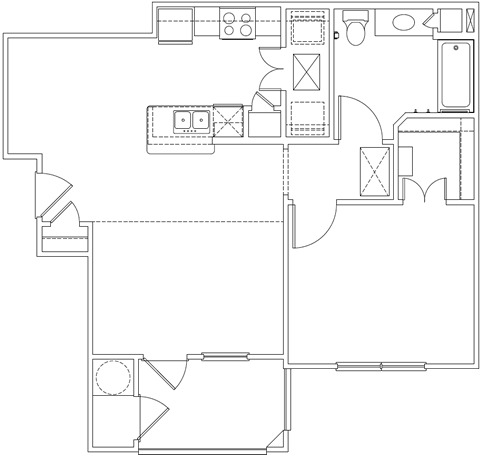
Find the location of `bath`. bath is located at coordinates (462, 85).